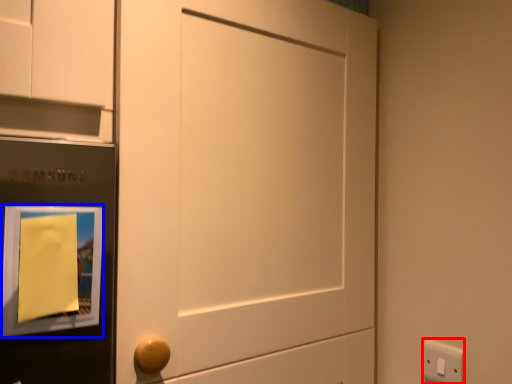
Question: Among these objects, which one is farthest to the camera, light switch (highlighted by a red box) or picture frame (highlighted by a blue box)?

Choices:
 (A) light switch
 (B) picture frame

Answer: (A)